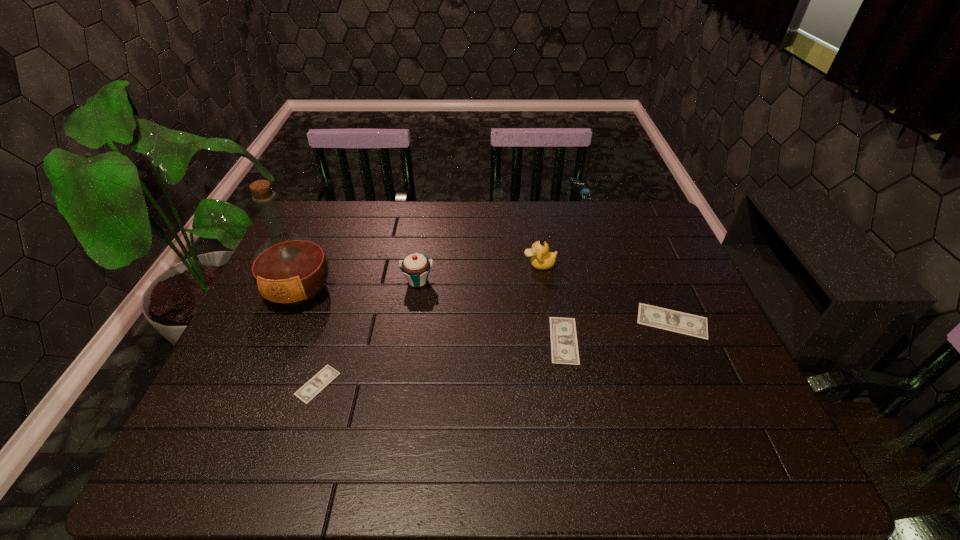
The height and width of the screenshot is (540, 960). I want to click on the leftmost money, so click(x=307, y=392).

You are a GUI agent. You are given a task and a screenshot of the screen. Output one action in this format:
    pyautogui.click(x=<x>, y=<y>)
    Task: Click on the shortest money
    
    Given the screenshot: What is the action you would take?
    (x=307, y=392)

The image size is (960, 540). In order to click on the second money from left to right in this screenshot , I will do `click(564, 348)`.

I want to click on the second shortest money, so click(564, 348).

Locate an element on the screen. This screenshot has height=540, width=960. the rightmost money is located at coordinates (683, 323).

In order to click on the tallest object in this screenshot , I will do `click(289, 269)`.

Identify the location of duckling. This screenshot has width=960, height=540. (541, 259).

At what (x,y) coordinates should I click in order to perform the action: click on the fourth object from right to left. Please return your answer as a coordinate pair (x, y). Image resolution: width=960 pixels, height=540 pixels. Looking at the image, I should click on (415, 267).

Identify the location of vacant space situated 0.340m on the back of the shortest object. The width and height of the screenshot is (960, 540). (353, 271).

This screenshot has width=960, height=540. I want to click on free spot located 0.350m on the back of the second money from left to right, so click(545, 237).